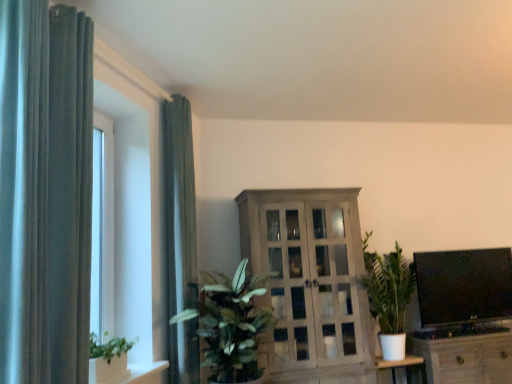
Where is `green leafy plant at center`? This screenshot has height=384, width=512. green leafy plant at center is located at coordinates (231, 324).

This screenshot has height=384, width=512. Describe the element at coordinates (465, 355) in the screenshot. I see `wooden cabinet at lower right, which appears as the second cabinetry when viewed from the left` at that location.

What do you see at coordinates (179, 206) in the screenshot?
I see `matte gray curtain at left, the 2th curtain viewed from the front` at bounding box center [179, 206].

What do you see at coordinates (138, 373) in the screenshot?
I see `white glossy shelf at lower left` at bounding box center [138, 373].

Image resolution: width=512 pixels, height=384 pixels. What do you see at coordinates (310, 284) in the screenshot?
I see `wooden cabinet at center, acting as the first cabinetry starting from the left` at bounding box center [310, 284].

You are a GUI agent. You are given a task and a screenshot of the screen. Output one action in this format:
    pyautogui.click(x=<x>, y=<y>)
    Task: Click on the green leafy plant at center
    Image resolution: width=512 pixels, height=384 pixels.
    Given the screenshot: What is the action you would take?
    pyautogui.click(x=231, y=324)

Identify the location of shelf above the wooden cabinet at lower right, arranged as the 1th cabinetry when viewed from the right (from the image's perspective). This screenshot has width=512, height=384. (138, 373).

Would you consider white glossy shelf at lower left to be distant from wooden cabinet at lower right, which appears as the second cabinetry when viewed from the left?

That's right, there is a large distance between white glossy shelf at lower left and wooden cabinet at lower right, which appears as the second cabinetry when viewed from the left.

Is white glossy shelf at lower left bigger than wooden cabinet at lower right, arranged as the 1th cabinetry when viewed from the right?

No, white glossy shelf at lower left is not bigger than wooden cabinet at lower right, arranged as the 1th cabinetry when viewed from the right.

Is point (497, 347) behind point (4, 284)?

Yes, point (497, 347) is behind point (4, 284).

What's the angular difference between wooden cabinet at lower right, which appears as the second cabinetry when viewed from the left, and velvet dark green curtain at left, the 2th curtain positioned from the back,'s facing directions?

89.4 degrees.

Is wooden cabinet at lower right, which appears as the second cabinetry when viewed from the left, wider than velvet dark green curtain at left, the 1th curtain when ordered from front to back?

Correct, the width of wooden cabinet at lower right, which appears as the second cabinetry when viewed from the left, exceeds that of velvet dark green curtain at left, the 1th curtain when ordered from front to back.

Which is correct: wooden cabinet at lower right, arranged as the 1th cabinetry when viewed from the right, is inside velvet dark green curtain at left, the 2th curtain positioned from the back, or outside of it?

wooden cabinet at lower right, arranged as the 1th cabinetry when viewed from the right, lies outside velvet dark green curtain at left, the 2th curtain positioned from the back.

Can you confirm if black glossy flat screen tv at right is wider than matte gray curtain at left, the 2th curtain viewed from the front?

Indeed, black glossy flat screen tv at right has a greater width compared to matte gray curtain at left, the 2th curtain viewed from the front.

From a real-world perspective, is black glossy flat screen tv at right physically located above or below matte gray curtain at left, the 2th curtain viewed from the front?

black glossy flat screen tv at right is below matte gray curtain at left, the 2th curtain viewed from the front.

Which is behind, point (420, 288) or point (170, 129)?

Positioned behind is point (420, 288).

Choose the correct answer: Is black glossy flat screen tv at right inside matte gray curtain at left, the 2th curtain viewed from the front, or outside it?

black glossy flat screen tv at right lies outside matte gray curtain at left, the 2th curtain viewed from the front.

Identify the location of curtain on the left of white glossy shelf at lower left. The height and width of the screenshot is (384, 512). (45, 192).

Considering the relative sizes of velvet dark green curtain at left, the 2th curtain positioned from the back, and white glossy shelf at lower left in the image provided, is velvet dark green curtain at left, the 2th curtain positioned from the back, bigger than white glossy shelf at lower left?

Yes.

From a real-world perspective, which object rests below the other?

white glossy shelf at lower left, from a real-world perspective.

Does velvet dark green curtain at left, the 1th curtain when ordered from front to back, have a lesser height compared to white glossy shelf at lower left?

No, velvet dark green curtain at left, the 1th curtain when ordered from front to back, is not shorter than white glossy shelf at lower left.

From their relative heights in the image, would you say wooden cabinet at lower right, which appears as the second cabinetry when viewed from the left, is taller or shorter than white matte table at lower right?

In the image, wooden cabinet at lower right, which appears as the second cabinetry when viewed from the left, appears to be taller than white matte table at lower right.

Could you tell me if wooden cabinet at lower right, which appears as the second cabinetry when viewed from the left, is facing white matte table at lower right?

No, wooden cabinet at lower right, which appears as the second cabinetry when viewed from the left, does not turn towards white matte table at lower right.

Locate an element on the screen. table behind the wooden cabinet at lower right, which appears as the second cabinetry when viewed from the left is located at coordinates (403, 367).

Is point (423, 336) closer or farther from the camera than point (403, 360)?

Clearly, point (423, 336) is more distant from the camera than point (403, 360).

Based on the photo, is green leafy plant at center far away from white glossy shelf at lower left?

No, green leafy plant at center is not far from white glossy shelf at lower left.

Does green leafy plant at center come behind white glossy shelf at lower left?

Yes, it is behind white glossy shelf at lower left.

Is green leafy plant at center shorter than white glossy shelf at lower left?

No.

From the image's perspective, is green leafy plant at center positioned above or below white glossy shelf at lower left?

green leafy plant at center is situated higher than white glossy shelf at lower left in the image.

Considering the points (499, 342) and (184, 156), which point is in front, point (499, 342) or point (184, 156)?

The point (184, 156) is in front.

Do you think wooden cabinet at lower right, arranged as the 1th cabinetry when viewed from the right, is within matte gray curtain at left, which appears as the first curtain when viewed from the back, or outside of it?

The correct answer is: outside.

Does wooden cabinet at lower right, arranged as the 1th cabinetry when viewed from the right, have a larger size compared to matte gray curtain at left, which appears as the first curtain when viewed from the back?

Yes.

From a real-world perspective, between wooden cabinet at lower right, arranged as the 1th cabinetry when viewed from the right, and matte gray curtain at left, which appears as the first curtain when viewed from the back, who is vertically higher?

matte gray curtain at left, which appears as the first curtain when viewed from the back.

Locate an element on the screen. Image resolution: width=512 pixels, height=384 pixels. cabinetry that is below the white glossy shelf at lower left (from the image's perspective) is located at coordinates (465, 355).

The height and width of the screenshot is (384, 512). Identify the location of curtain that is the 2nd one when counting upward from the wooden cabinet at lower right, which appears as the second cabinetry when viewed from the left (from the image's perspective). (45, 192).

Based on their spatial positions, is green leafy plant at center or matte gray curtain at left, the 2th curtain viewed from the front, closer to wooden cabinet at center, which ranks as the second cabinetry in right-to-left order?

The object closer to wooden cabinet at center, which ranks as the second cabinetry in right-to-left order, is green leafy plant at center.

Which object lies nearer to the anchor point black glossy flat screen tv at right, wooden cabinet at center, acting as the first cabinetry starting from the left, or matte gray curtain at left, which appears as the first curtain when viewed from the back?

wooden cabinet at center, acting as the first cabinetry starting from the left, is positioned closer to the anchor black glossy flat screen tv at right.

Estimate the real-world distances between objects in this image. Which object is further from wooden cabinet at lower right, which appears as the second cabinetry when viewed from the left, white matte table at lower right or matte gray curtain at left, which appears as the first curtain when viewed from the back?

matte gray curtain at left, which appears as the first curtain when viewed from the back, lies further to wooden cabinet at lower right, which appears as the second cabinetry when viewed from the left, than the other object.

Consider the image. When comparing their distances from green leafy plant at center, does white glossy shelf at lower left or black glossy flat screen tv at right seem further?

black glossy flat screen tv at right.

Based on their spatial positions, is black glossy flat screen tv at right or matte gray curtain at left, the 2th curtain viewed from the front, further from white matte table at lower right?

matte gray curtain at left, the 2th curtain viewed from the front, is further to white matte table at lower right.

Which object lies further to the anchor point wooden cabinet at lower right, which appears as the second cabinetry when viewed from the left, green leafy plant at center or white matte table at lower right?

green leafy plant at center is positioned further to the anchor wooden cabinet at lower right, which appears as the second cabinetry when viewed from the left.

Looking at the image, which one is located further to black glossy flat screen tv at right, green leafy plant at center or velvet dark green curtain at left, the 2th curtain positioned from the back?

velvet dark green curtain at left, the 2th curtain positioned from the back, lies further to black glossy flat screen tv at right than the other object.

From the image, which object appears to be nearer to white matte table at lower right, matte gray curtain at left, which appears as the first curtain when viewed from the back, or velvet dark green curtain at left, the 2th curtain positioned from the back?

matte gray curtain at left, which appears as the first curtain when viewed from the back, lies closer to white matte table at lower right than the other object.

You are a GUI agent. You are given a task and a screenshot of the screen. Output one action in this format:
    pyautogui.click(x=<x>, y=<y>)
    Task: Click on the cabinetry between green leafy plant at center and wooden cabinet at lower right, which appears as the second cabinetry when viewed from the left, in the horizontal direction
    This screenshot has width=512, height=384.
    Given the screenshot: What is the action you would take?
    pos(310,284)

At what (x,y) coordinates should I click in order to perform the action: click on curtain between velvet dark green curtain at left, the 2th curtain positioned from the back, and wooden cabinet at center, which ranks as the second cabinetry in right-to-left order, in the front-back direction. Please return your answer as a coordinate pair (x, y). The image size is (512, 384). Looking at the image, I should click on (179, 206).

Locate an element on the screen. Image resolution: width=512 pixels, height=384 pixels. houseplant between velvet dark green curtain at left, the 1th curtain when ordered from front to back, and wooden cabinet at center, acting as the first cabinetry starting from the left, in the front-back direction is located at coordinates (231, 324).

Find the location of a particular element. shelf between velvet dark green curtain at left, the 2th curtain positioned from the back, and black glossy flat screen tv at right from left to right is located at coordinates (138, 373).